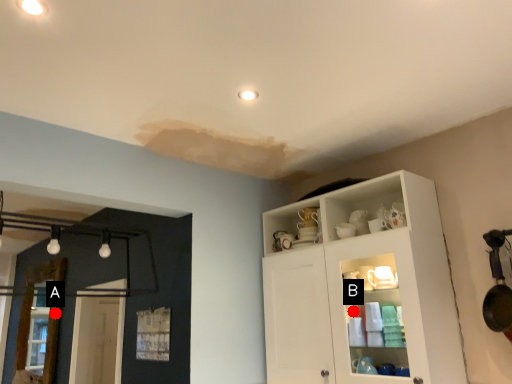
Question: Two points are circled on the image, labeled by A and B beside each circle. Which point is closer to the camera?

Choices:
 (A) A is closer
 (B) B is closer

Answer: (B)